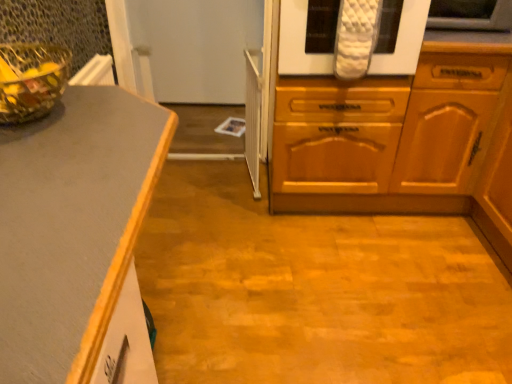
This screenshot has width=512, height=384. Describe the element at coordinates (395, 136) in the screenshot. I see `wooden cabinet at center` at that location.

This screenshot has height=384, width=512. Describe the element at coordinates (298, 42) in the screenshot. I see `white quilted oven mitts at upper center` at that location.

Measure the distance between transparent glass bowl at upper left and camera.

transparent glass bowl at upper left and camera are 3.48 feet apart from each other.

This screenshot has height=384, width=512. Find the location of `wooden cabinet at center`. wooden cabinet at center is located at coordinates (395, 136).

Is white quilted oven mitt at upper right situated inside white quilted oven mitts at upper center or outside?

The correct answer is: outside.

How different are the orientations of white quilted oven mitt at upper right and white quilted oven mitts at upper center in degrees?

The facing directions of white quilted oven mitt at upper right and white quilted oven mitts at upper center are 3.58 degrees apart.

Consider the image. Does white quilted oven mitt at upper right have a smaller size compared to white quilted oven mitts at upper center?

Correct, white quilted oven mitt at upper right occupies less space than white quilted oven mitts at upper center.

How much distance is there between white quilted oven mitt at upper right and white quilted oven mitts at upper center?

white quilted oven mitt at upper right and white quilted oven mitts at upper center are 16.21 inches apart from each other.

From a real-world perspective, is transparent glass bowl at upper left on top of white quilted oven mitt at upper right?

Indeed, from a real-world perspective, transparent glass bowl at upper left stands above white quilted oven mitt at upper right.

Does transparent glass bowl at upper left have a smaller size compared to white quilted oven mitt at upper right?

Yes.

In the image, is transparent glass bowl at upper left positioned in front of or behind white quilted oven mitt at upper right?

In the image, transparent glass bowl at upper left appears in front of white quilted oven mitt at upper right.

Based on the photo, considering the sizes of objects transparent glass bowl at upper left and white quilted oven mitt at upper right in the image provided, who is shorter, transparent glass bowl at upper left or white quilted oven mitt at upper right?

white quilted oven mitt at upper right.

Is white quilted oven mitts at upper center at the right side of transparent glass bowl at upper left?

Yes.

Between white quilted oven mitts at upper center and transparent glass bowl at upper left, which one has smaller size?

With smaller size is transparent glass bowl at upper left.

Consider the image. How much distance is there between white quilted oven mitts at upper center and transparent glass bowl at upper left?

They are 3.49 feet apart.

Is white quilted oven mitts at upper center completely or partially outside of transparent glass bowl at upper left?

Yes.

From the image's perspective, is transparent glass bowl at upper left below wooden cabinet at center?

Correct, transparent glass bowl at upper left appears lower than wooden cabinet at center in the image.

Is transparent glass bowl at upper left positioned beyond the bounds of wooden cabinet at center?

transparent glass bowl at upper left lies outside wooden cabinet at center's area.

Which object is thinner, transparent glass bowl at upper left or wooden cabinet at center?

Thinner between the two is transparent glass bowl at upper left.

Is transparent glass bowl at upper left far away from wooden cabinet at center?

Yes, transparent glass bowl at upper left is far from wooden cabinet at center.

Is white quilted oven mitt at upper right not near transparent glass bowl at upper left?

Yes, white quilted oven mitt at upper right is far from transparent glass bowl at upper left.

Based on the photo, is white quilted oven mitt at upper right oriented away from transparent glass bowl at upper left?

white quilted oven mitt at upper right does not have its back to transparent glass bowl at upper left.

Based on their sizes in the image, would you say white quilted oven mitt at upper right is bigger or smaller than transparent glass bowl at upper left?

In the image, white quilted oven mitt at upper right appears to be larger than transparent glass bowl at upper left.

Is white quilted oven mitt at upper right to the left or to the right of transparent glass bowl at upper left in the image?

In the image, white quilted oven mitt at upper right appears on the right side of transparent glass bowl at upper left.

Which object is positioned more to the right, wooden cabinet at center or white quilted oven mitts at upper center?

From the viewer's perspective, white quilted oven mitts at upper center appears more on the right side.

How different are the orientations of wooden cabinet at center and white quilted oven mitts at upper center in degrees?

They differ by 0.000382 degrees in their facing directions.

Does wooden cabinet at center have a smaller size compared to white quilted oven mitts at upper center?

Incorrect, wooden cabinet at center is not smaller in size than white quilted oven mitts at upper center.

From the image's perspective, which object appears higher, wooden cabinet at center or white quilted oven mitts at upper center?

white quilted oven mitts at upper center, from the image's perspective.

In the image, there is a transparent glass bowl at upper left. Identify the location of oven above it (from the image's perspective). The image size is (512, 384). (298, 42).

From the image's perspective, is transparent glass bowl at upper left located above or below white quilted oven mitts at upper center?

transparent glass bowl at upper left is below white quilted oven mitts at upper center.

What's the angular difference between transparent glass bowl at upper left and white quilted oven mitts at upper center's facing directions?

They differ by 90 degrees in their facing directions.

Considering the relative sizes of transparent glass bowl at upper left and white quilted oven mitts at upper center in the image provided, is transparent glass bowl at upper left bigger than white quilted oven mitts at upper center?

No, transparent glass bowl at upper left is not bigger than white quilted oven mitts at upper center.

Where is `oven below the white quilted oven mitt at upper right (from the image's perspective)`? oven below the white quilted oven mitt at upper right (from the image's perspective) is located at coordinates (298, 42).

The width and height of the screenshot is (512, 384). What are the coordinates of `glass bowl above the white quilted oven mitt at upper right (from a real-world perspective)` in the screenshot? It's located at (31, 80).

Based on their spatial positions, is white quilted oven mitts at upper center or white quilted oven mitt at upper right further from transparent glass bowl at upper left?

white quilted oven mitt at upper right is further to transparent glass bowl at upper left.

From the image, which object appears to be farther from wooden cabinet at center, transparent glass bowl at upper left or white quilted oven mitt at upper right?

Among the two, transparent glass bowl at upper left is located further to wooden cabinet at center.

From the image, which object appears to be farther from white quilted oven mitt at upper right, white quilted oven mitts at upper center or transparent glass bowl at upper left?

Among the two, transparent glass bowl at upper left is located further to white quilted oven mitt at upper right.

Based on their spatial positions, is wooden cabinet at center or transparent glass bowl at upper left closer to white quilted oven mitts at upper center?

Among the two, wooden cabinet at center is located nearer to white quilted oven mitts at upper center.

In the scene shown: Looking at the image, which one is located further to transparent glass bowl at upper left, wooden cabinet at center or white quilted oven mitts at upper center?

wooden cabinet at center is positioned further to the anchor transparent glass bowl at upper left.

From the image, which object appears to be nearer to wooden cabinet at center, white quilted oven mitts at upper center or white quilted oven mitt at upper right?

white quilted oven mitts at upper center lies closer to wooden cabinet at center than the other object.

From the image, which object appears to be nearer to white quilted oven mitt at upper right, wooden cabinet at center or transparent glass bowl at upper left?

A: The object closer to white quilted oven mitt at upper right is wooden cabinet at center.

Looking at the image, which one is located further to white quilted oven mitt at upper right, transparent glass bowl at upper left or white quilted oven mitts at upper center?

transparent glass bowl at upper left is further to white quilted oven mitt at upper right.

I want to click on oven between wooden cabinet at center and white quilted oven mitt at upper right from left to right, so click(x=298, y=42).

The height and width of the screenshot is (384, 512). I want to click on cabinetry between transparent glass bowl at upper left and white quilted oven mitt at upper right from left to right, so click(395, 136).

Image resolution: width=512 pixels, height=384 pixels. In order to click on cabinetry between transparent glass bowl at upper left and white quilted oven mitts at upper center in the horizontal direction in this screenshot , I will do `click(395, 136)`.

You are a GUI agent. You are given a task and a screenshot of the screen. Output one action in this format:
    pyautogui.click(x=<x>, y=<y>)
    Task: Click on the oven located between transparent glass bowl at upper left and white quilted oven mitt at upper right in the left-right direction
    
    Given the screenshot: What is the action you would take?
    point(298,42)